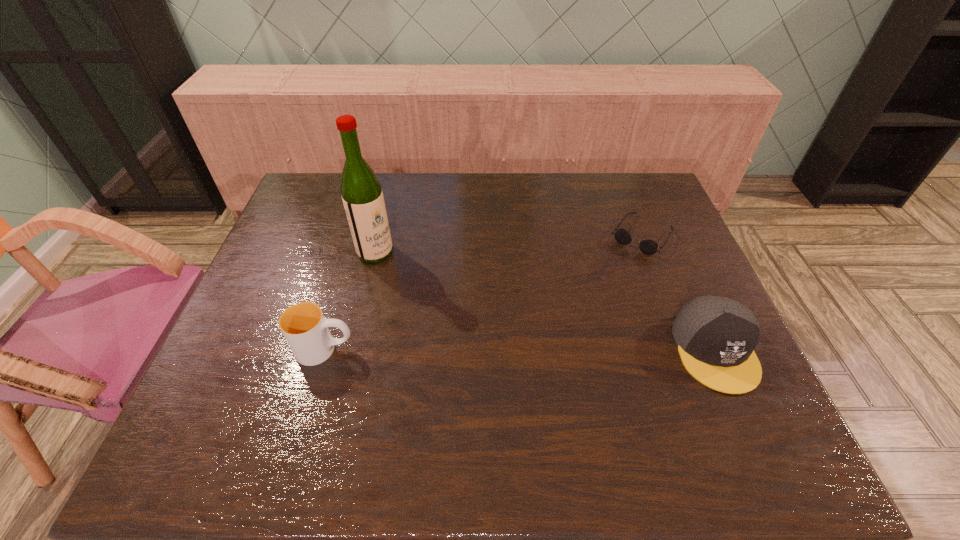
You are a GUI agent. You are given a task and a screenshot of the screen. Output one action in this format:
    pyautogui.click(x=<x>, y=<y>)
    Task: Click on the vacant space at the right edge
    
    Given the screenshot: What is the action you would take?
    pyautogui.click(x=675, y=231)

In order to click on vacant space at the far left corner of the desktop in this screenshot , I will do `click(310, 181)`.

The height and width of the screenshot is (540, 960). Identify the location of vacant space at the near left corner of the desktop. (203, 407).

The image size is (960, 540). Identify the location of vacant space at the far right corner of the desktop. (656, 192).

This screenshot has width=960, height=540. Identify the location of free spot between the cup and the tallest object. (350, 301).

Find the location of a particular element. The height and width of the screenshot is (540, 960). vacant region between the cap and the cup is located at coordinates (520, 350).

I want to click on free point between the cap and the sunglasses, so click(x=679, y=293).

You are a GUI agent. You are given a task and a screenshot of the screen. Output one action in this format:
    pyautogui.click(x=<x>, y=<y>)
    Task: Click on the free spot between the cap and the shortest object
    
    Given the screenshot: What is the action you would take?
    pyautogui.click(x=679, y=293)

Image resolution: width=960 pixels, height=540 pixels. In order to click on free point between the cup and the liquor in this screenshot , I will do `click(350, 301)`.

At what (x,y) coordinates should I click in order to perform the action: click on free spot between the cap and the sunglasses. Please return your answer as a coordinate pair (x, y). This screenshot has width=960, height=540. Looking at the image, I should click on (679, 293).